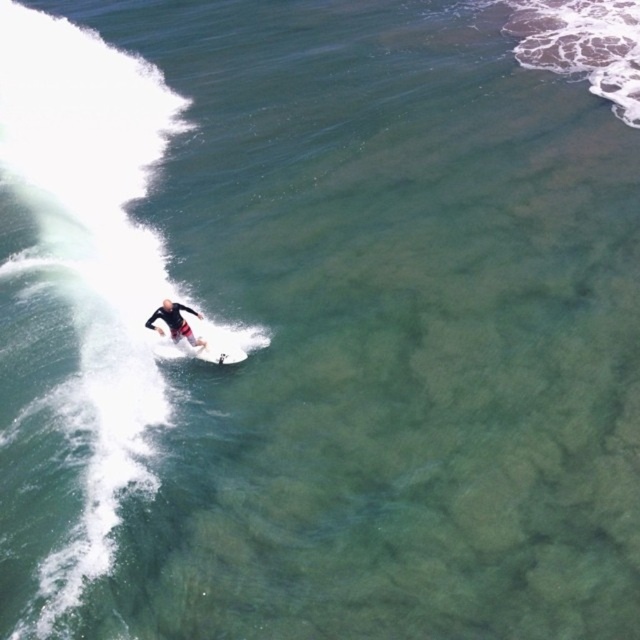
Does white foam surfboard at center appear over black wetsuit surfer at center?

Actually, white foam surfboard at center is below black wetsuit surfer at center.

Who is positioned more to the left, white foam surfboard at center or black wetsuit surfer at center?

black wetsuit surfer at center is more to the left.

Does point (224, 364) lie in front of point (173, 314)?

No, it is not.

You are a GUI agent. You are given a task and a screenshot of the screen. Output one action in this format:
    pyautogui.click(x=<x>, y=<y>)
    Task: Click on the white foam surfboard at center
    
    Given the screenshot: What is the action you would take?
    pyautogui.click(x=202, y=349)